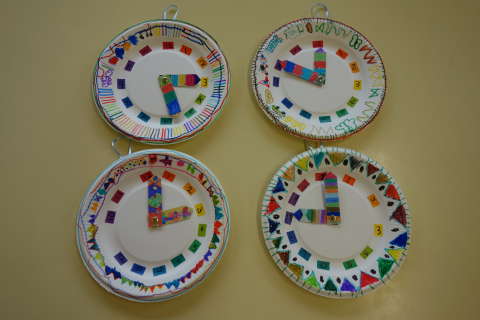
At what (x,y) coordinates should I click in order to perform the action: click on clock 4. Please return your answer as a coordinate pair (x, y). This screenshot has height=320, width=480. Looking at the image, I should click on (324, 243).